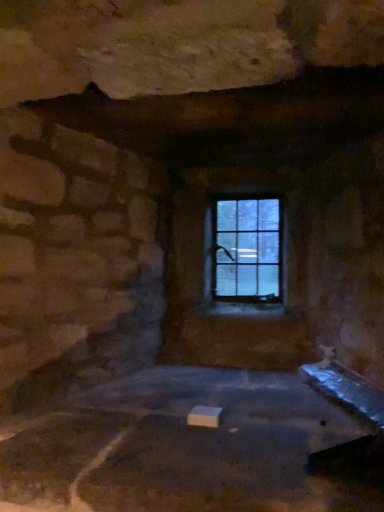
Consider the image. What is the approximate height of clear glass window at center?

The height of clear glass window at center is 21.84 inches.

The image size is (384, 512). What do you see at coordinates (245, 249) in the screenshot?
I see `clear glass window at center` at bounding box center [245, 249].

In order to face clear glass window at center, should I rotate leftwards or rightwards?

You should look right and rotate roughly 7.663 degrees.

This screenshot has width=384, height=512. Identify the location of clear glass window at center. (245, 249).

The width and height of the screenshot is (384, 512). I want to click on clear glass window at center, so click(x=245, y=249).